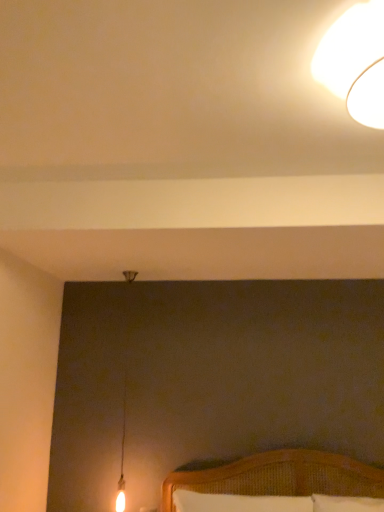
What is the approximate width of white glossy lampshade at upper right?

13.49 inches.

Image resolution: width=384 pixels, height=512 pixels. What are the coordinates of `white glossy lampshade at upper right` in the screenshot? It's located at (355, 62).

What do you see at coordinates (355, 62) in the screenshot? Image resolution: width=384 pixels, height=512 pixels. I see `white glossy lampshade at upper right` at bounding box center [355, 62].

What is the approximate width of white woven pillow at lower center?

white woven pillow at lower center is 4.62 inches wide.

I want to click on white woven pillow at lower center, so click(x=238, y=502).

The width and height of the screenshot is (384, 512). What do you see at coordinates (238, 502) in the screenshot?
I see `white woven pillow at lower center` at bounding box center [238, 502].

This screenshot has width=384, height=512. In order to click on white glossy lampshade at upper right in this screenshot , I will do `click(355, 62)`.

Between white woven pillow at lower center and white glossy lampshade at upper right, which one appears on the right side from the viewer's perspective?

From the viewer's perspective, white glossy lampshade at upper right appears more on the right side.

Considering the relative positions of white woven pillow at lower center and white glossy lampshade at upper right in the image provided, is white woven pillow at lower center behind white glossy lampshade at upper right?

Yes, white woven pillow at lower center is further from the camera.

Is point (211, 504) closer or farther from the camera than point (333, 58)?

Point (211, 504) appears to be farther away from the viewer than point (333, 58).

From the image's perspective, which one is positioned higher, white woven pillow at lower center or white glossy lampshade at upper right?

white glossy lampshade at upper right is shown above in the image.

From a real-world perspective, between white woven pillow at lower center and white glossy lampshade at upper right, who is vertically lower?

white woven pillow at lower center, from a real-world perspective.

Between white woven pillow at lower center and white glossy lampshade at upper right, which one has larger width?

white glossy lampshade at upper right.

From the picture: Who is shorter, white woven pillow at lower center or white glossy lampshade at upper right?

Standing shorter between the two is white glossy lampshade at upper right.

Considering the sizes of white woven pillow at lower center and white glossy lampshade at upper right in the image, is white woven pillow at lower center bigger or smaller than white glossy lampshade at upper right?

In the image, white woven pillow at lower center appears to be larger than white glossy lampshade at upper right.

Could white glossy lampshade at upper right be considered to be inside white woven pillow at lower center?

Definitely not — white glossy lampshade at upper right is not inside white woven pillow at lower center.

Is white woven pillow at lower center not near white glossy lampshade at upper right?

white woven pillow at lower center is positioned a significant distance from white glossy lampshade at upper right.

Is white woven pillow at lower center looking in the opposite direction of white glossy lampshade at upper right?

white woven pillow at lower center does not have its back to white glossy lampshade at upper right.

How many degrees apart are the facing directions of white woven pillow at lower center and white glossy lampshade at upper right?

The angular difference between white woven pillow at lower center and white glossy lampshade at upper right is 0.271 degrees.

Locate an element on the screen. The height and width of the screenshot is (512, 384). pillow behind the white glossy lampshade at upper right is located at coordinates (238, 502).

Would you say white glossy lampshade at upper right is to the left or to the right of white woven pillow at lower center in the picture?

Clearly, white glossy lampshade at upper right is on the right of white woven pillow at lower center in the image.

Which is behind, white glossy lampshade at upper right or white woven pillow at lower center?

white woven pillow at lower center is further from the camera.

Is point (362, 120) farther from camera compared to point (183, 509)?

No, (362, 120) is in front of (183, 509).

From the image's perspective, is white glossy lampshade at upper right on white woven pillow at lower center?

Yes, from the image's perspective, white glossy lampshade at upper right is on top of white woven pillow at lower center.

From a real-world perspective, does white glossy lampshade at upper right sit lower than white woven pillow at lower center?

No, from a real-world perspective, white glossy lampshade at upper right is not below white woven pillow at lower center.

Considering the relative sizes of white glossy lampshade at upper right and white woven pillow at lower center in the image provided, is white glossy lampshade at upper right wider than white woven pillow at lower center?

Yes.

Does white glossy lampshade at upper right have a greater height compared to white woven pillow at lower center?

No.

Is white glossy lampshade at upper right bigger than white woven pillow at lower center?

Incorrect, white glossy lampshade at upper right is not larger than white woven pillow at lower center.

Is white glossy lampshade at upper right not within white woven pillow at lower center?

Yes, white glossy lampshade at upper right is not within white woven pillow at lower center.

Is white glossy lampshade at upper right placed right next to white woven pillow at lower center?

No, white glossy lampshade at upper right is not touching white woven pillow at lower center.

Is white glossy lampshade at upper right facing away from white woven pillow at lower center?

white glossy lampshade at upper right does not have its back to white woven pillow at lower center.

Locate an element on the screen. The width and height of the screenshot is (384, 512). pillow below the white glossy lampshade at upper right (from a real-world perspective) is located at coordinates (238, 502).

Locate an element on the screen. Image resolution: width=384 pixels, height=512 pixels. lamp in front of the white woven pillow at lower center is located at coordinates (355, 62).

Where is `pillow lying below the white glossy lampshade at upper right (from the image's perspective)`? Image resolution: width=384 pixels, height=512 pixels. pillow lying below the white glossy lampshade at upper right (from the image's perspective) is located at coordinates (238, 502).